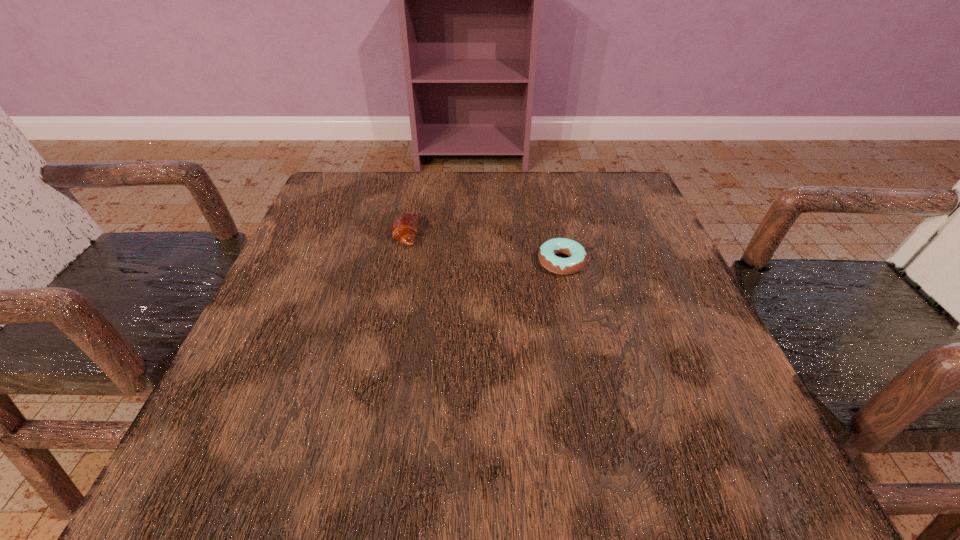
At what (x,y) coordinates should I click in order to perform the action: click on the left object. Please return your answer as a coordinate pair (x, y). The width and height of the screenshot is (960, 540). Looking at the image, I should click on (404, 228).

I want to click on the right object, so click(547, 253).

Identify the location of vacant region located 0.160m on the left of the crescent roll. [x=316, y=234].

You are a GUI agent. You are given a task and a screenshot of the screen. Output one action in this format:
    pyautogui.click(x=<x>, y=<y>)
    Task: Click on the vacant space located on the left of the doughnut
    
    Given the screenshot: What is the action you would take?
    pyautogui.click(x=409, y=262)

Find the location of a particular element. This screenshot has height=540, width=960. object that is at the far edge is located at coordinates (404, 228).

Identify the location of blank space at the far edge. (430, 201).

At what (x,y) coordinates should I click in order to perform the action: click on blank space at the near edge of the desktop. Please return your answer as a coordinate pair (x, y). This screenshot has width=960, height=540. Looking at the image, I should click on (349, 441).

Find the location of `free space at the left edge`. free space at the left edge is located at coordinates (312, 261).

Identify the location of vacant space at the right edge of the desktop. Image resolution: width=960 pixels, height=540 pixels. (656, 400).

This screenshot has height=540, width=960. In the image, there is a desktop. Find the location of `vacant space at the far left corner`. vacant space at the far left corner is located at coordinates (337, 194).